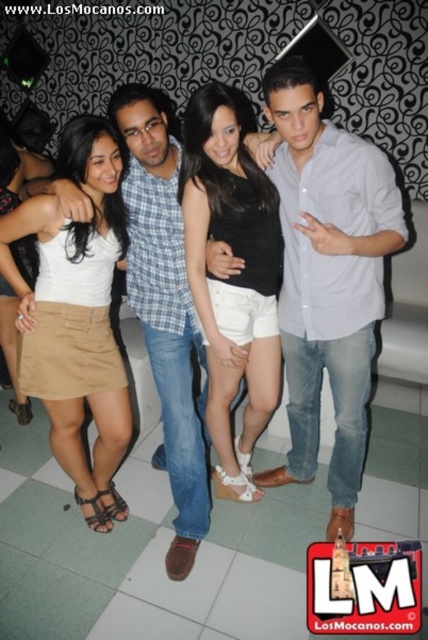
Looking at this image, you are a photographer trying to capture a closeup of the black matte shorts at center and the matte khaki skirt at center. Which of the two items would require you to zoom in more to fill the frame, considering their sizes?

The black matte shorts at center is thinner than the matte khaki skirt at center, so you would need to zoom in more on the black matte shorts at center to fill the frame since it is smaller in size.

You are a photographer adjusting your camera settings to focus on the light blue shirt at center and the black matte shorts at center. Which object should you focus on first if you want to capture both in the same frame without adjusting the camera angle?

The light blue shirt at center is taller than the black matte shorts at center, so you should focus on the light blue shirt at center first to ensure it is in the frame before the shorter object.